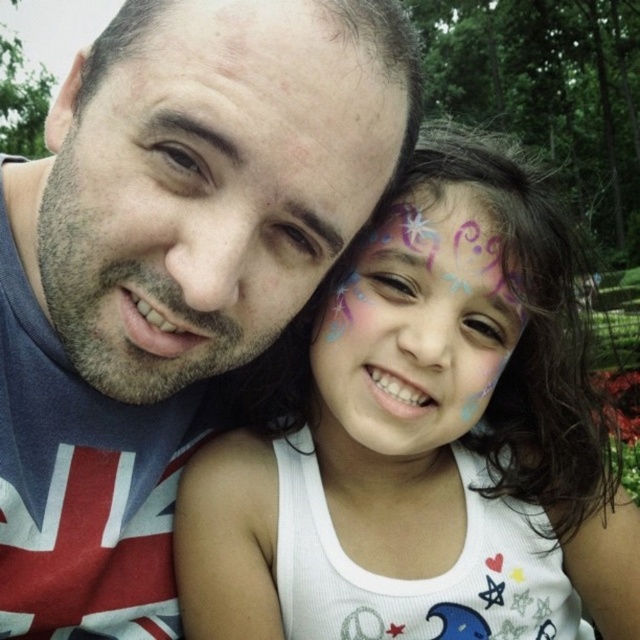
You are a photographer trying to capture a close up shot of the two people in the image. You want to ensure that both the white matte face paint at center and the pastel painted face at center are clearly visible. Which face paint area should you focus on first to ensure it doesn t get blurred due to its size?

The white matte face paint at center is larger in size than the pastel painted face at center, so you should focus on the white matte face paint at center first to ensure it stays in focus and doesn t get blurred due to its larger size.